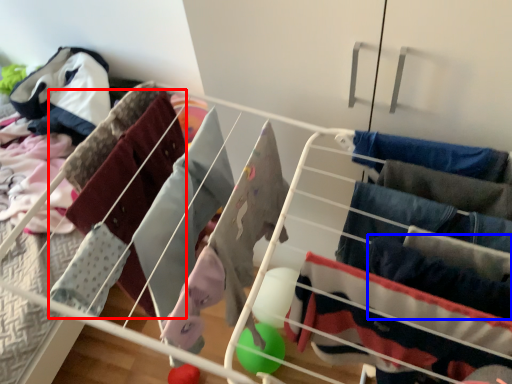
Question: Which of the following is the farthest to the observer, clothing (highlighted by a red box) or clothing (highlighted by a blue box)?

Choices:
 (A) clothing
 (B) clothing

Answer: (A)